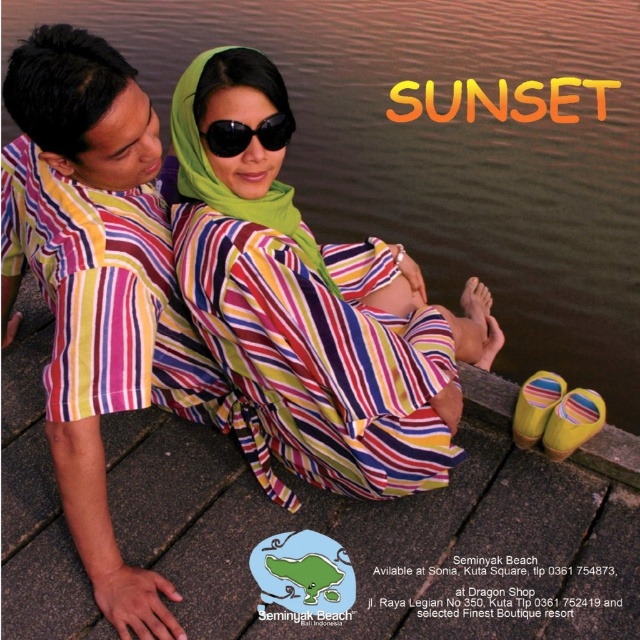
Based on the photo, you are a photographer trying to capture a candid shot of the two people on the dock. You notice the smooth brown water at center and the black matte sunglasses at center. Which object is positioned higher in the image?

The smooth brown water at center is much taller than the black matte sunglasses at center, so the smooth brown water at center is positioned higher in the image.

You are a photographer standing 1 meter away from the striped cotton shirt at left and the black matte sunglasses at center. You want to take a photo that captures both objects in the frame. Given that your camera has a maximum focus range of 1 meter, will both objects be in focus?

The distance between the striped cotton shirt at left and the black matte sunglasses at center is 59.97 centimeters, which is within the camera maximum focus range of 1 meter. Therefore, both objects will be in focus.